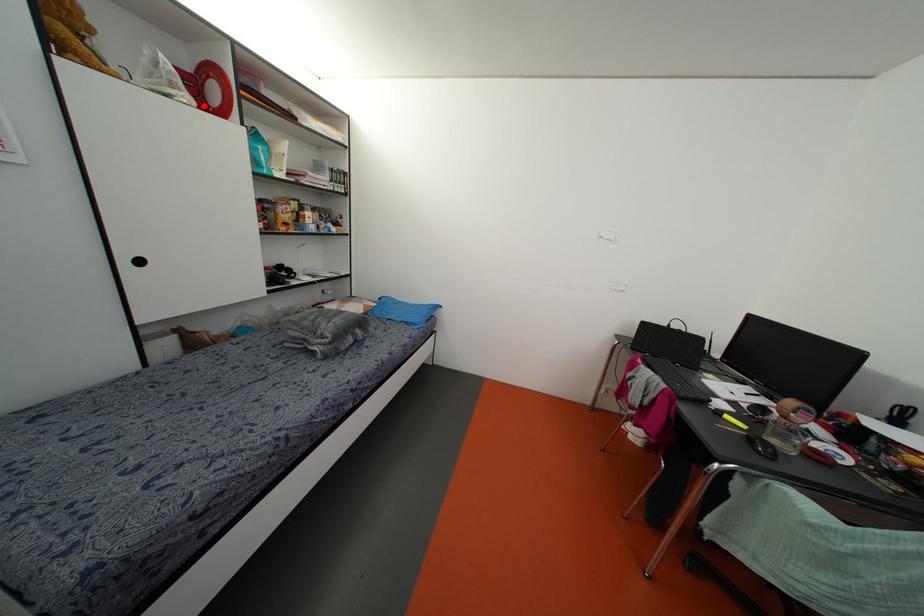
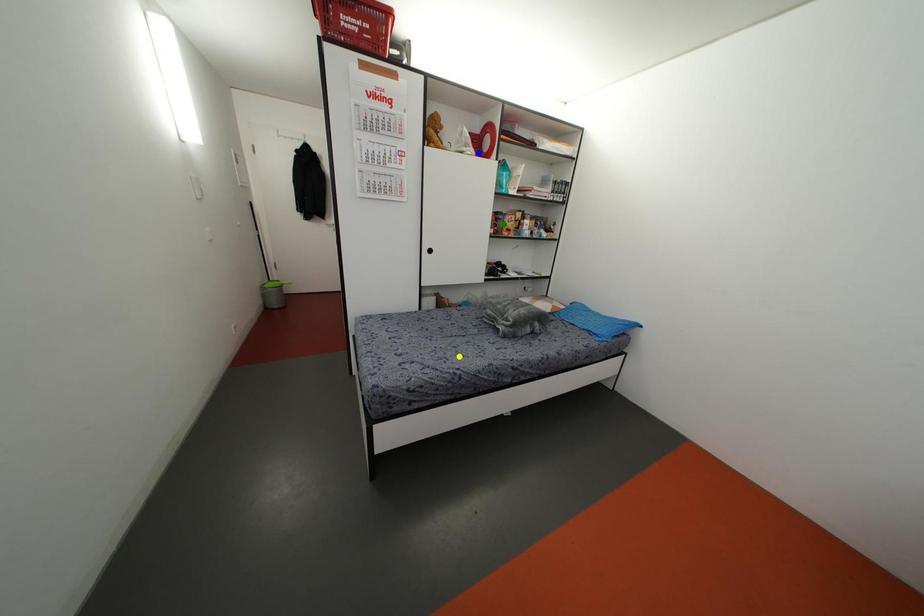
Question: I am providing you with two images of the same scene from different viewpoints. A red point is marked on the first image. You are given multiple points on the second image. Which point in image 2 represents the same 3d spot as the red point in image 1?

Choices:
 (A) green point
 (B) blue point
 (C) yellow point

Answer: (B)